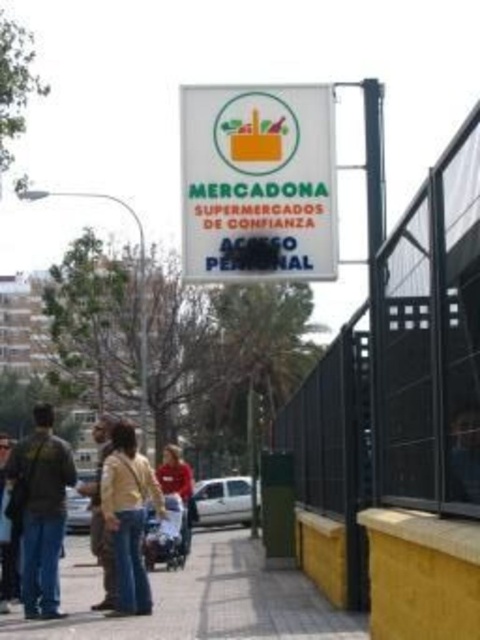
Question: Among these points, which one is nearest to the camera?

Choices:
 (A) (387, 244)
 (B) (100, 496)
 (C) (35, 445)

Answer: (A)

Question: Is dark brown leather jacket at left thinner than red cotton shirt at center?

Choices:
 (A) no
 (B) yes

Answer: (B)

Question: Is black metal fence at upper right below jeans at lower left?

Choices:
 (A) yes
 (B) no

Answer: (B)

Question: Which object is positioned farthest from the dark brown leather jacket at left?

Choices:
 (A) yellow concrete pavement at lower center
 (B) black metal fence at upper right

Answer: (B)

Question: Which point is closer to the camera?

Choices:
 (A) (72, 600)
 (B) (0, 518)
 (C) (11, 465)
 (D) (96, 428)

Answer: (C)

Question: Can you confirm if yellow leather jacket at center is smaller than jeans at lower left?

Choices:
 (A) yes
 (B) no

Answer: (A)